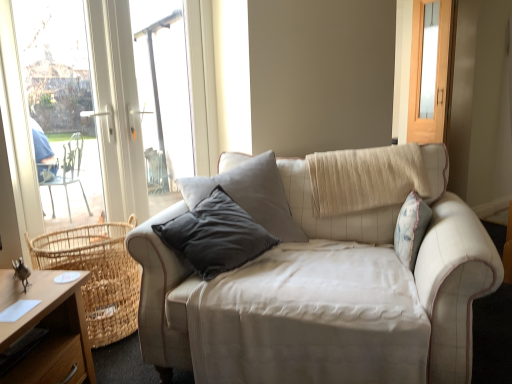
What is the approximate width of matte wooden screen door at upper right?

4.57 inches.

What do you see at coordinates (452, 274) in the screenshot?
I see `beige fabric couch at center` at bounding box center [452, 274].

The height and width of the screenshot is (384, 512). What are the coordinates of `woven natural basket at lower left` in the screenshot? It's located at (97, 275).

Considering the points (54, 269) and (447, 20), which point is behind, point (54, 269) or point (447, 20)?

The point (447, 20) is farther from the camera.

Consider the image. From the image's perspective, is woven natural basket at lower left on top of matte wooden screen door at upper right?

Incorrect, from the image's perspective, woven natural basket at lower left is lower than matte wooden screen door at upper right.

Considering the relative sizes of woven natural basket at lower left and matte wooden screen door at upper right in the image provided, is woven natural basket at lower left smaller than matte wooden screen door at upper right?

No.

In the image, there is a woven natural basket at lower left. Where is `screen door above it (from the image's perspective)`? This screenshot has height=384, width=512. screen door above it (from the image's perspective) is located at coordinates (431, 70).

Is matte wooden screen door at upper right outside of wooden desk at lower left?

Yes.

Consider the image. Which is less distant, (426, 130) or (73, 330)?

Clearly, point (426, 130) is more distant from the camera than point (73, 330).

Is matte wooden screen door at upper right aimed at wooden desk at lower left?

No, matte wooden screen door at upper right is not facing towards wooden desk at lower left.

Is matte wooden screen door at upper right bigger than wooden desk at lower left?

Incorrect, matte wooden screen door at upper right is not larger than wooden desk at lower left.

Is point (243, 154) closer or farther from the camera than point (408, 130)?

Point (243, 154).

Between beige fabric couch at center and matte wooden screen door at upper right, which one has larger size?

Bigger between the two is beige fabric couch at center.

From the image's perspective, which is below, beige fabric couch at center or matte wooden screen door at upper right?

beige fabric couch at center appears lower in the image.

Consider the image. How far apart are beige fabric couch at center and matte wooden screen door at upper right?

beige fabric couch at center is 6.63 feet away from matte wooden screen door at upper right.

Is beige fabric couch at center behind woven natural basket at lower left?

No, beige fabric couch at center is closer to the viewer.

Is beige fabric couch at center surrounding woven natural basket at lower left?

Result: No.

Is beige fabric couch at center completely or partially outside of wooden desk at lower left?

Yes, beige fabric couch at center is outside of wooden desk at lower left.

Is beige fabric couch at center at the right side of wooden desk at lower left?

Yes, beige fabric couch at center is to the right of wooden desk at lower left.

Does beige fabric couch at center have a lesser width compared to wooden desk at lower left?

In fact, beige fabric couch at center might be wider than wooden desk at lower left.

How different are the orientations of wooden desk at lower left and matte wooden screen door at upper right in degrees?

141 degrees separate the facing orientations of wooden desk at lower left and matte wooden screen door at upper right.

Based on the photo, which object is thinner, wooden desk at lower left or matte wooden screen door at upper right?

Thinner between the two is matte wooden screen door at upper right.

Who is taller, wooden desk at lower left or matte wooden screen door at upper right?

Standing taller between the two is matte wooden screen door at upper right.

Is wooden desk at lower left in contact with matte wooden screen door at upper right?

No, wooden desk at lower left is not next to matte wooden screen door at upper right.

Can you tell me how much matte wooden screen door at upper right and beige fabric couch at center differ in facing direction?

The angular difference between matte wooden screen door at upper right and beige fabric couch at center is 45.5 degrees.

In the image, is matte wooden screen door at upper right positioned in front of or behind beige fabric couch at center?

matte wooden screen door at upper right is behind beige fabric couch at center.

Find the location of a particular element. This screenshot has width=512, height=384. screen door behind the beige fabric couch at center is located at coordinates (431, 70).

From the image's perspective, which one is positioned higher, matte wooden screen door at upper right or beige fabric couch at center?

matte wooden screen door at upper right is shown above in the image.

At what (x,y) coordinates should I click in order to perform the action: click on basket on the left side of matte wooden screen door at upper right. Please return your answer as a coordinate pair (x, y). Looking at the image, I should click on (97, 275).

Locate an element on the screen. screen door above the wooden desk at lower left (from a real-world perspective) is located at coordinates (431, 70).

From the image, which object appears to be farther from wooden desk at lower left, woven natural basket at lower left or matte wooden screen door at upper right?

Based on the image, matte wooden screen door at upper right appears to be further to wooden desk at lower left.

From the picture: Estimate the real-world distances between objects in this image. Which object is further from wooden desk at lower left, matte wooden screen door at upper right or beige fabric couch at center?

Based on the image, matte wooden screen door at upper right appears to be further to wooden desk at lower left.

Consider the image. Estimate the real-world distances between objects in this image. Which object is further from woven natural basket at lower left, wooden desk at lower left or matte wooden screen door at upper right?

Among the two, matte wooden screen door at upper right is located further to woven natural basket at lower left.

Estimate the real-world distances between objects in this image. Which object is further from wooden desk at lower left, matte wooden screen door at upper right or woven natural basket at lower left?

The object further to wooden desk at lower left is matte wooden screen door at upper right.

Which object lies further to the anchor point beige fabric couch at center, matte wooden screen door at upper right or wooden desk at lower left?

matte wooden screen door at upper right is positioned further to the anchor beige fabric couch at center.

Estimate the real-world distances between objects in this image. Which object is closer to beige fabric couch at center, wooden desk at lower left or woven natural basket at lower left?

Among the two, woven natural basket at lower left is located nearer to beige fabric couch at center.

Estimate the real-world distances between objects in this image. Which object is closer to matte wooden screen door at upper right, beige fabric couch at center or wooden desk at lower left?

beige fabric couch at center is closer to matte wooden screen door at upper right.

Based on their spatial positions, is beige fabric couch at center or wooden desk at lower left further from woven natural basket at lower left?

Based on the image, beige fabric couch at center appears to be further to woven natural basket at lower left.

Image resolution: width=512 pixels, height=384 pixels. I want to click on desk between beige fabric couch at center and matte wooden screen door at upper right in the front-back direction, so click(x=49, y=329).

You are a GUI agent. You are given a task and a screenshot of the screen. Output one action in this format:
    pyautogui.click(x=<x>, y=<y>)
    Task: Click on the basket between wooden desk at lower left and beige fabric couch at center from left to right
    The image size is (512, 384).
    Given the screenshot: What is the action you would take?
    pyautogui.click(x=97, y=275)

Where is `basket between wooden desk at lower left and matte wooden screen door at upper right from left to right`? The width and height of the screenshot is (512, 384). basket between wooden desk at lower left and matte wooden screen door at upper right from left to right is located at coordinates (97, 275).

Image resolution: width=512 pixels, height=384 pixels. I want to click on studio couch between woven natural basket at lower left and matte wooden screen door at upper right, so click(x=452, y=274).